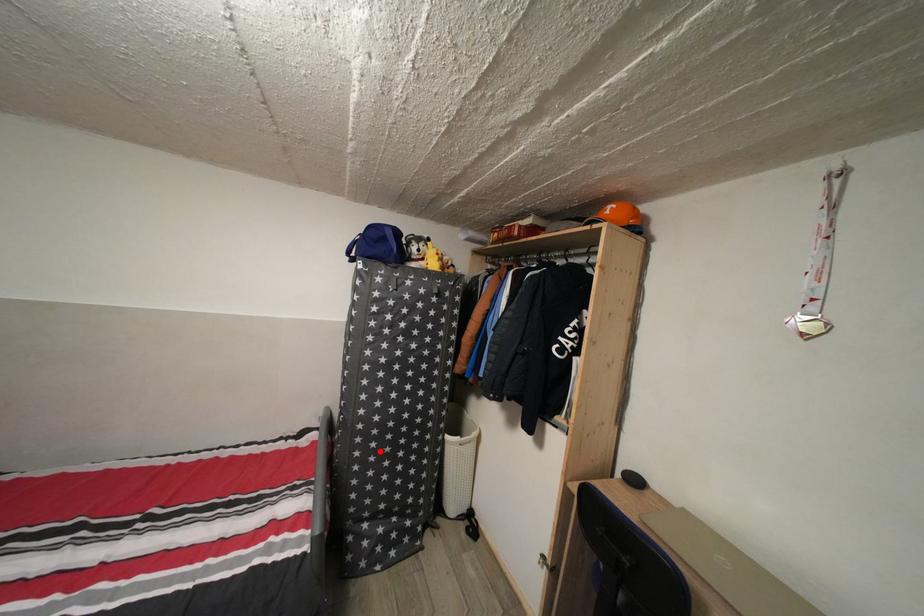
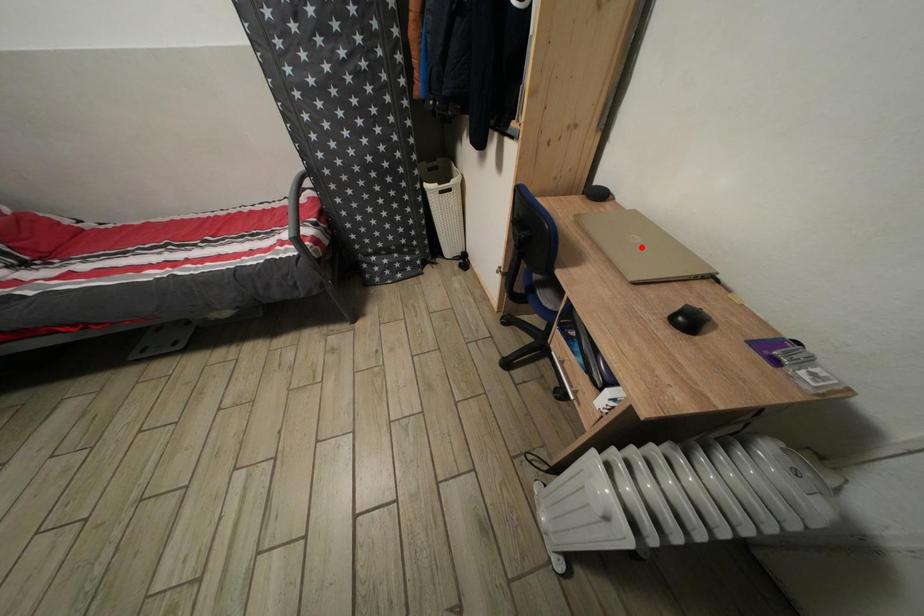
I am providing you with two images of the same scene from different viewpoints. A red point is marked on the first image and another point is marked on the second image. Is the red point in image1 aligned with the point shown in image2?

No